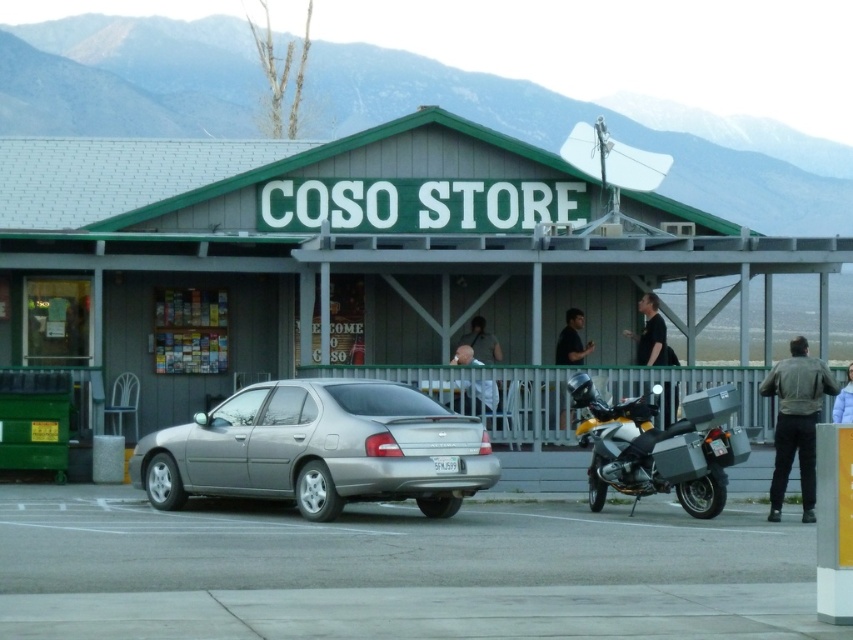
You are a delivery driver who needs to park your vehicle next to the matte gray building at center. However, there is already a satin silver sedan at center parked there. Can your vehicle fit next to the sedan without overlapping?

The matte gray building at center is larger in size than the satin silver sedan at center. Since the building is bigger, there might be enough space next to the sedan to park your vehicle without overlapping, but this depends on the exact dimensions of your vehicle and the available space.

You are standing at the entrance of the COSO STORE and notice a person in a black matte shirt at center. Which direction should you walk to reach the matte gray building at center from your current position?

The matte gray building at center is to the right of the black matte shirt at center, so you should walk to the right to reach it.